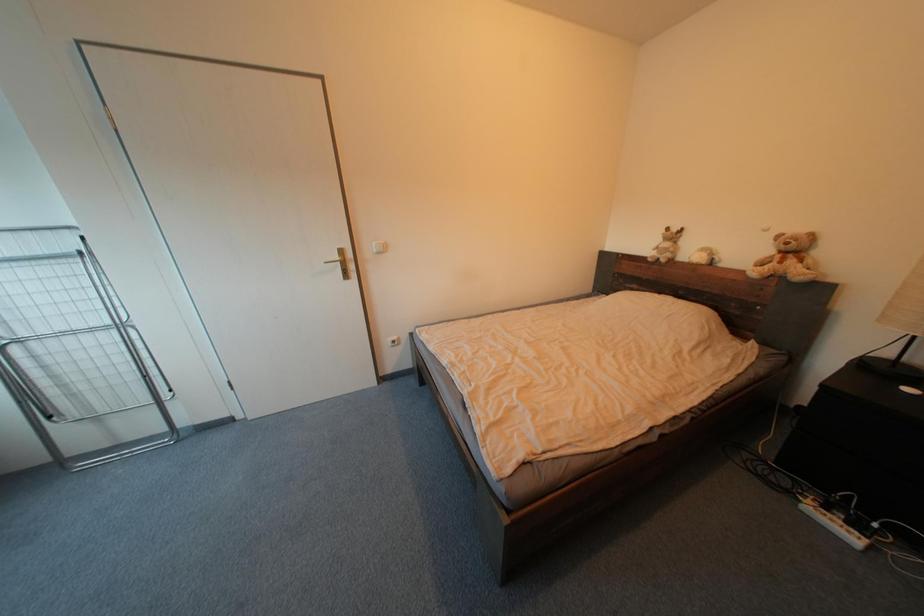
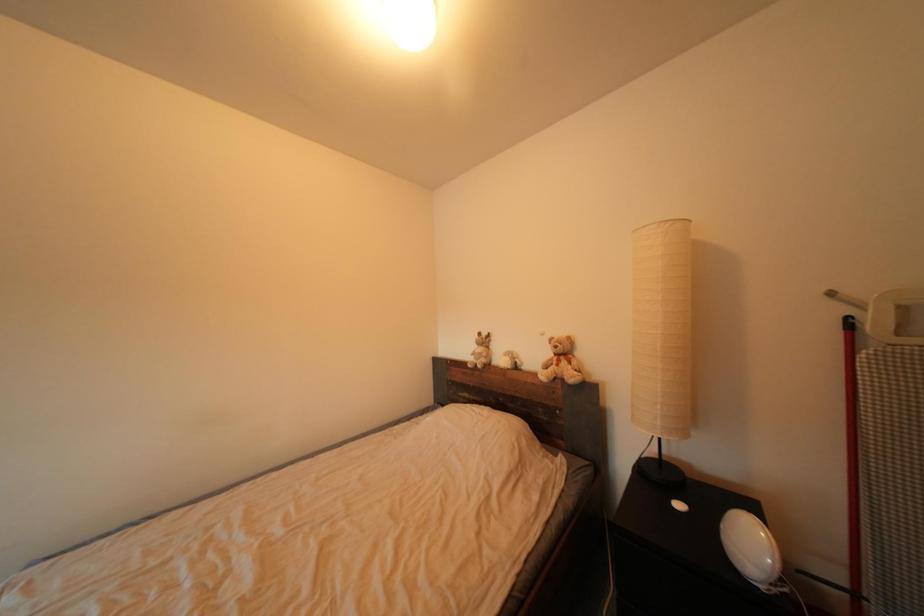
First-person continuous shooting, in which direction is the camera rotating?

The camera rotated toward right-up.